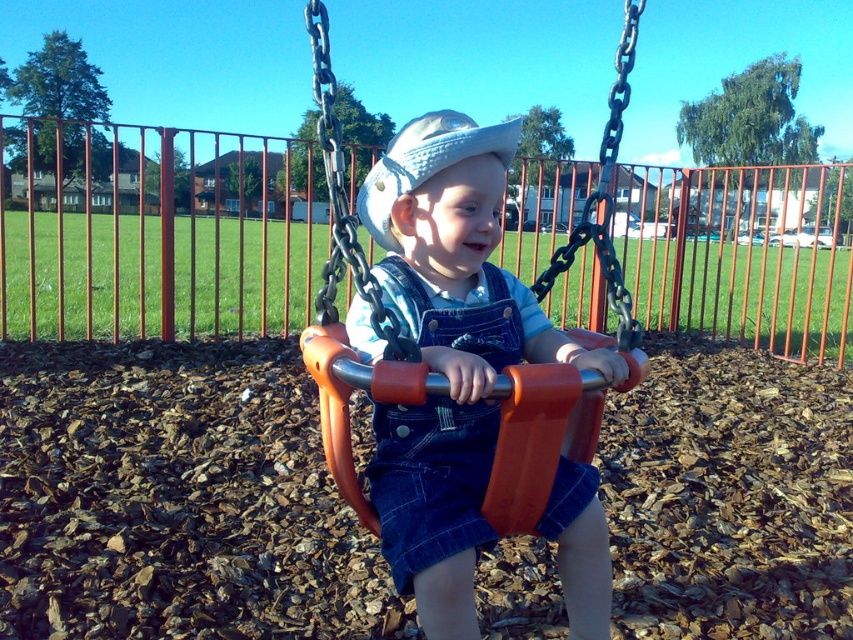
Question: Can you confirm if denim overalls at center is positioned to the left of white fabric hat at center?

Choices:
 (A) no
 (B) yes

Answer: (A)

Question: Is denim overalls at center positioned in front of white fabric hat at center?

Choices:
 (A) yes
 (B) no

Answer: (A)

Question: Among these objects, which one is farthest from the camera?

Choices:
 (A) denim overalls at center
 (B) white fabric hat at center

Answer: (B)

Question: Is denim overalls at center to the right of white fabric hat at center from the viewer's perspective?

Choices:
 (A) yes
 (B) no

Answer: (A)

Question: Which point is closer to the camera?

Choices:
 (A) white fabric hat at center
 (B) denim overalls at center

Answer: (B)